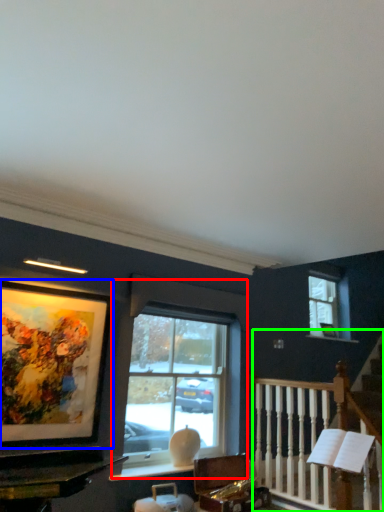
Question: Which object is the farthest from window (highlighted by a red box)? Choose among these: picture frame (highlighted by a blue box) or rail (highlighted by a green box).

Choices:
 (A) picture frame
 (B) rail

Answer: (A)